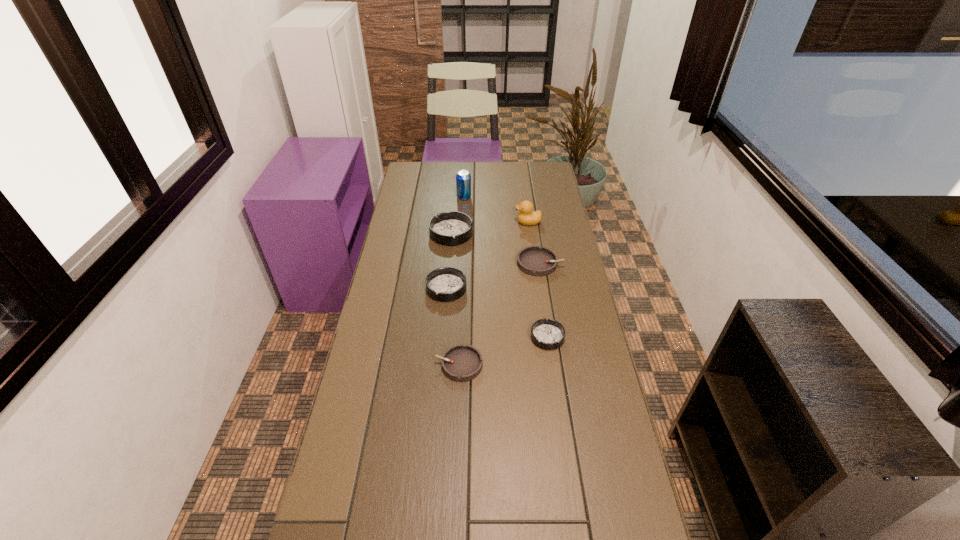
Select which dark ashtray appears as the closest to the biggest dark ashtray. Please provide its 2D coordinates. Your answer should be formatted as a tuple, i.e. [(x, y)], where the tuple contains the x and y coordinates of a point satisfying the conditions above.

[(445, 284)]

Select which dark ashtray appears as the closest to the second smallest dark ashtray. Please provide its 2D coordinates. Your answer should be formatted as a tuple, i.e. [(x, y)], where the tuple contains the x and y coordinates of a point satisfying the conditions above.

[(450, 228)]

This screenshot has height=540, width=960. Find the location of `the closest gray ashtray relative to the farthest dark ashtray`. the closest gray ashtray relative to the farthest dark ashtray is located at coordinates (533, 260).

Locate an element on the screen. the closest gray ashtray relative to the second smallest dark ashtray is located at coordinates (533, 260).

Where is `blank space that satisfies the following two spatial constraints: 1. on the front side of the farthest ashtray; 2. on the right side of the left gray ashtray`? blank space that satisfies the following two spatial constraints: 1. on the front side of the farthest ashtray; 2. on the right side of the left gray ashtray is located at coordinates (441, 364).

This screenshot has height=540, width=960. Identify the location of vacant area that satisfies the following two spatial constraints: 1. on the face of the farther gray ashtray; 2. on the right side of the duckling. (534, 263).

This screenshot has width=960, height=540. In order to click on free space that satisfies the following two spatial constraints: 1. on the back side of the farther gray ashtray; 2. on the left side of the nearer gray ashtray in this screenshot , I will do `click(464, 263)`.

I want to click on vacant space that satisfies the following two spatial constraints: 1. on the back side of the blue beer can; 2. on the left side of the farthest ashtray, so click(454, 197).